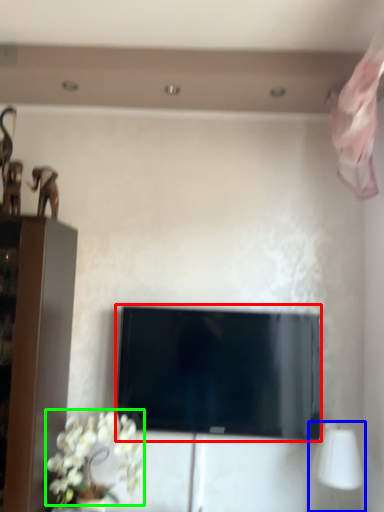
Question: Which is nearer to the television (highlighted by a red box)? table lamp (highlighted by a blue box) or flower (highlighted by a green box).

Choices:
 (A) table lamp
 (B) flower

Answer: (B)